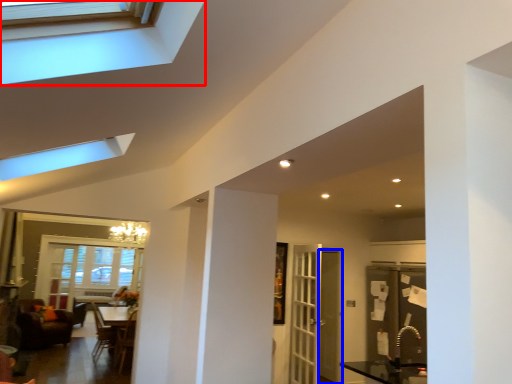
Question: Which of the following is the closest to the observer, window (highlighted by a red box) or screen door (highlighted by a blue box)?

Choices:
 (A) window
 (B) screen door

Answer: (A)